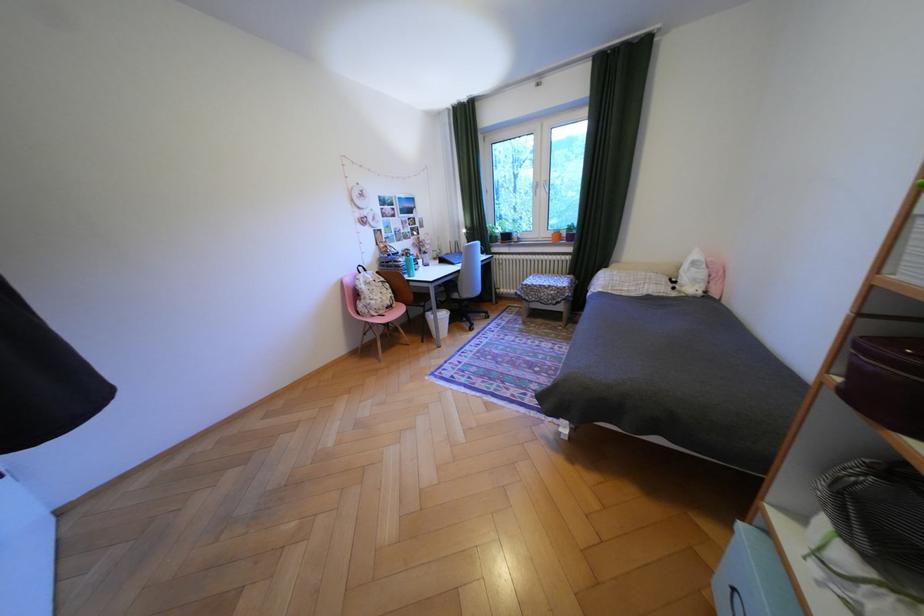
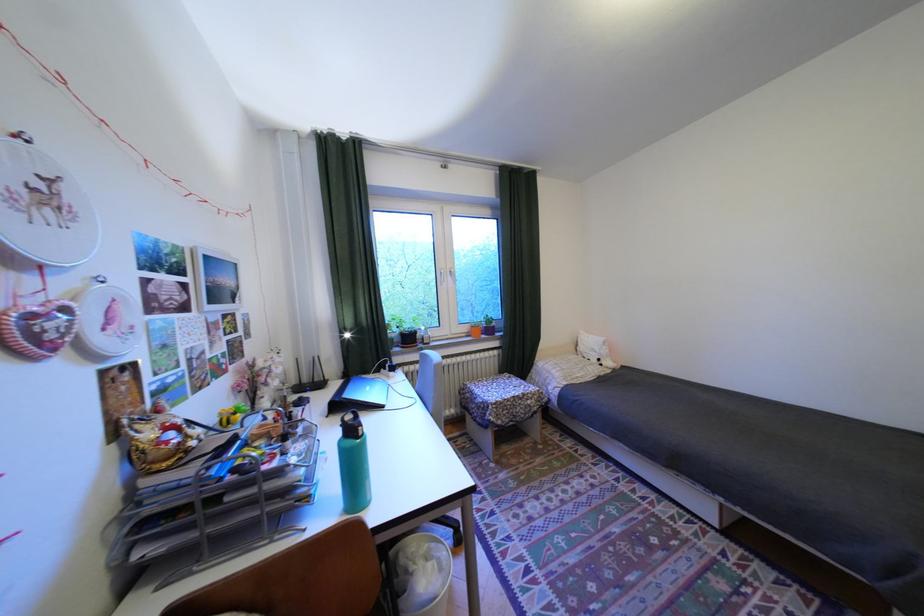
Locate, in the second image, the point that corresponds to point (373, 195) in the first image.

(58, 197)